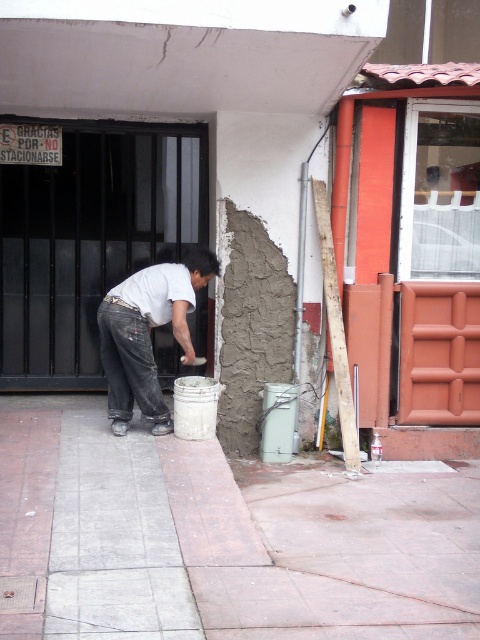
You are a construction inspector checking the work site. You notice the concrete at center and the white matte shirt at center. Which object is taller?

The white matte shirt at center is taller than the concrete at center.

You are a construction inspector observing the worker in the image. You need to ensure safety protocols are followed. Since the worker is bending over, does the concrete at center pose a tripping hazard to the white matte shirt at center?

The concrete at center is below the white matte shirt at center, so it is positioned lower and likely not in the immediate path, reducing the tripping hazard for the white matte shirt at center.

You are a construction worker who needs to know the size of the materials you are working with. Which object, the concrete at center or the white matte shirt at center, is bigger in size?

The concrete at center is larger in size than the white matte shirt at center.